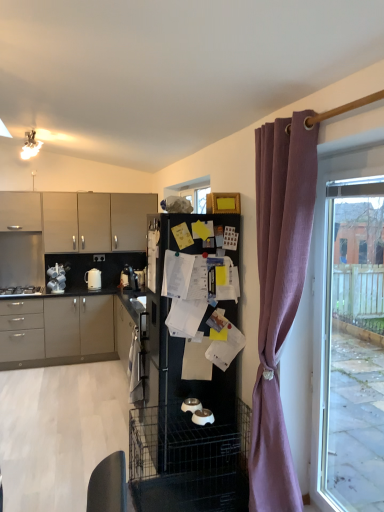
Question: From the image's perspective, is stainless steel gas stove at left above or below white glossy pet bowls at center, acting as the first appliance starting from the right?

Choices:
 (A) below
 (B) above

Answer: (B)

Question: In the image, is stainless steel gas stove at left positioned in front of or behind white glossy pet bowls at center, which ranks as the 1th appliance in bottom-to-top order?

Choices:
 (A) front
 (B) behind

Answer: (B)

Question: Estimate the real-world distances between objects in this image. Which object is farther from the white glossy kettle at left, which is counted as the second appliance, starting from the left?

Choices:
 (A) matte gray cabinets at left, arranged as the 3th cabinetry when viewed from the top
 (B) white glossy bowls at center, the 3th appliance positioned from the back
 (C) matte gray cabinets at upper left, acting as the 2th cabinetry starting from the top
 (D) white glossy kettle at left, positioned as the first appliance in top-to-bottom order
 (E) stainless steel gas stove at left

Answer: (B)

Question: Based on their relative distances, which object is nearer to the stainless steel gas stove at left?

Choices:
 (A) white glossy kettle at left, the 1th appliance positioned from the back
 (B) mauve fabric curtain at right
 (C) matte beige cabinet at upper left, marked as the first cabinetry in a top-to-bottom arrangement
 (D) white glossy kettle at left, the 4th appliance from the bottom
 (E) black matte refrigerator at center

Answer: (D)